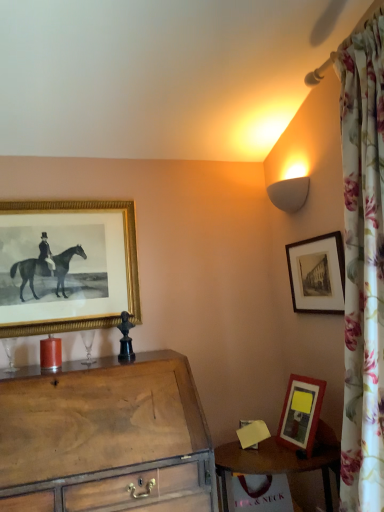
Question: Is wooden chest of drawers at lower left bigger or smaller than black matte picture frame at upper right, the 1th picture frame positioned from the right?

Choices:
 (A) small
 (B) big

Answer: (B)

Question: Does point (125, 437) appear closer or farther from the camera than point (292, 260)?

Choices:
 (A) closer
 (B) farther

Answer: (A)

Question: Based on their relative distances, which object is farther from the wooden chest of drawers at lower left?

Choices:
 (A) black matte picture frame at upper right, which is the second picture frame in left-to-right order
 (B) gold textured picture frame at upper left, which ranks as the 1th picture frame in left-to-right order
 (C) wooden table at lower right
 (D) matte glass candle at left

Answer: (A)

Question: Which object is the farthest from the matte glass candle at left?

Choices:
 (A) wooden table at lower right
 (B) black matte picture frame at upper right, the 1th picture frame positioned from the right
 (C) wooden chest of drawers at lower left
 (D) gold textured picture frame at upper left, the 2th picture frame viewed from the right

Answer: (B)